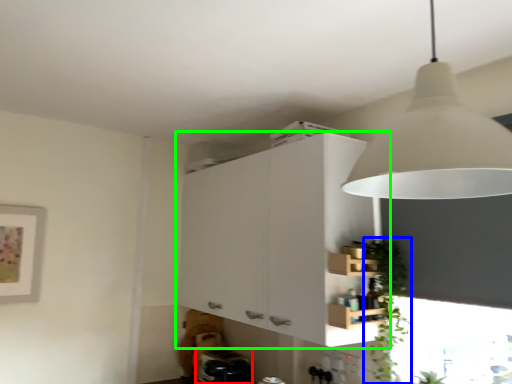
Question: Which is nearer to the appliance (highlighted by a red box)? plant (highlighted by a blue box) or cabinetry (highlighted by a green box).

Choices:
 (A) plant
 (B) cabinetry

Answer: (B)